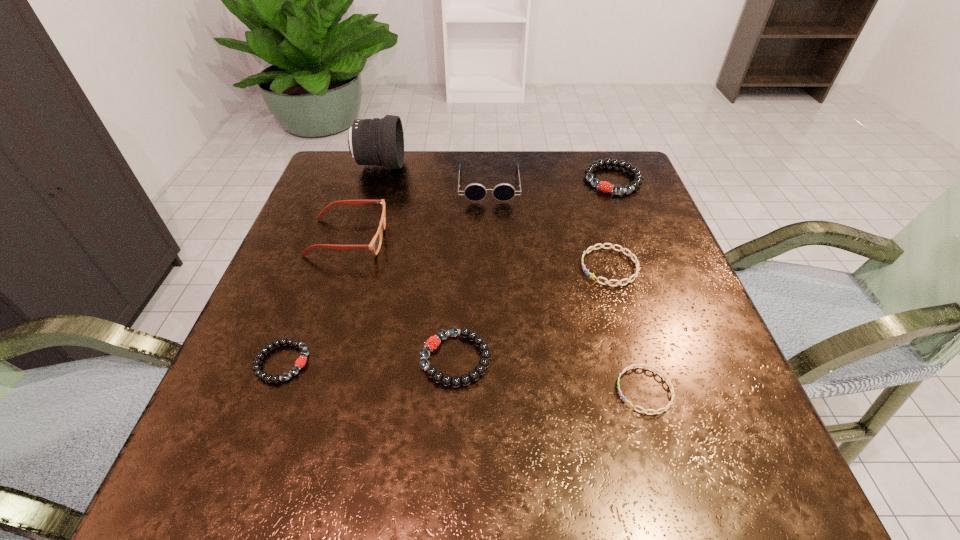
Find the location of a particular element. The width and height of the screenshot is (960, 540). free point located on the surface of the farther blue bracelet showing star-shaped elements is located at coordinates (391, 267).

Where is `free spot located 0.110m on the surface of the farther blue bracelet showing star-shaped elements`? free spot located 0.110m on the surface of the farther blue bracelet showing star-shaped elements is located at coordinates (529, 267).

Where is `vacant space situated on the right of the smallest black bracelet`? Image resolution: width=960 pixels, height=540 pixels. vacant space situated on the right of the smallest black bracelet is located at coordinates (541, 362).

At what (x,y) coordinates should I click in order to perform the action: click on free space located 0.260m on the surface of the smaller blue bracelet showing star-shaped elements. Please return your answer as a coordinate pair (x, y). Image resolution: width=960 pixels, height=540 pixels. Looking at the image, I should click on (458, 390).

In order to click on vacant area situated on the surface of the smaller blue bracelet showing star-shaped elements in this screenshot , I will do tap(574, 390).

Where is `free spot located on the surface of the smaller blue bracelet showing star-shaped elements`? This screenshot has height=540, width=960. free spot located on the surface of the smaller blue bracelet showing star-shaped elements is located at coordinates (531, 390).

Identify the location of telephoto lens present at the far edge. (376, 141).

At what (x,y) coordinates should I click in order to perform the action: click on sunglasses at the far edge. Please return your answer as a coordinate pair (x, y). Looking at the image, I should click on (475, 192).

This screenshot has height=540, width=960. I want to click on bracelet that is at the far edge, so click(604, 186).

The width and height of the screenshot is (960, 540). I want to click on telephoto lens present at the left edge, so [376, 141].